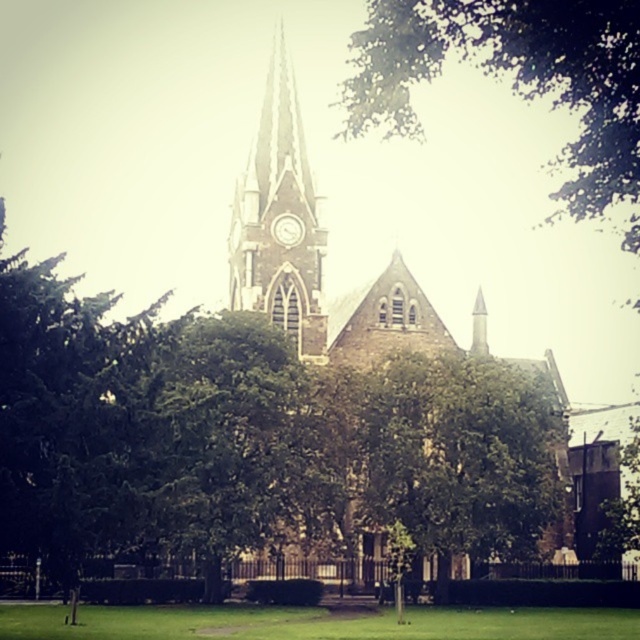
Question: Is green leafy tree at center smaller than white glossy clock at center?

Choices:
 (A) no
 (B) yes

Answer: (A)

Question: Which point is closer to the camera?

Choices:
 (A) green leafy tree at center
 (B) brown stone church at center
 (C) dark brown stone clock tower at center

Answer: (C)

Question: Is brown stone church at center smaller than dark brown stone clock tower at center?

Choices:
 (A) yes
 (B) no

Answer: (B)

Question: Which point is closer to the camera taking this photo?

Choices:
 (A) (298, 218)
 (B) (301, 289)
 (C) (420, 529)

Answer: (C)

Question: Which point is closer to the camera taking this photo?

Choices:
 (A) (531, 497)
 (B) (304, 268)

Answer: (B)

Question: Considering the relative positions of brown stone church at center and dark brown stone clock tower at center in the image provided, where is brown stone church at center located with respect to dark brown stone clock tower at center?

Choices:
 (A) left
 (B) right

Answer: (B)